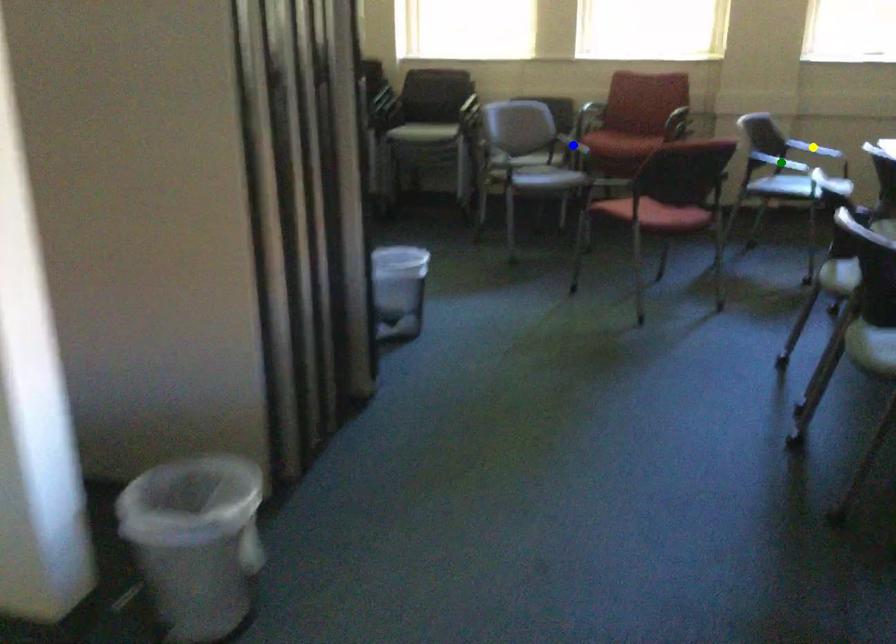
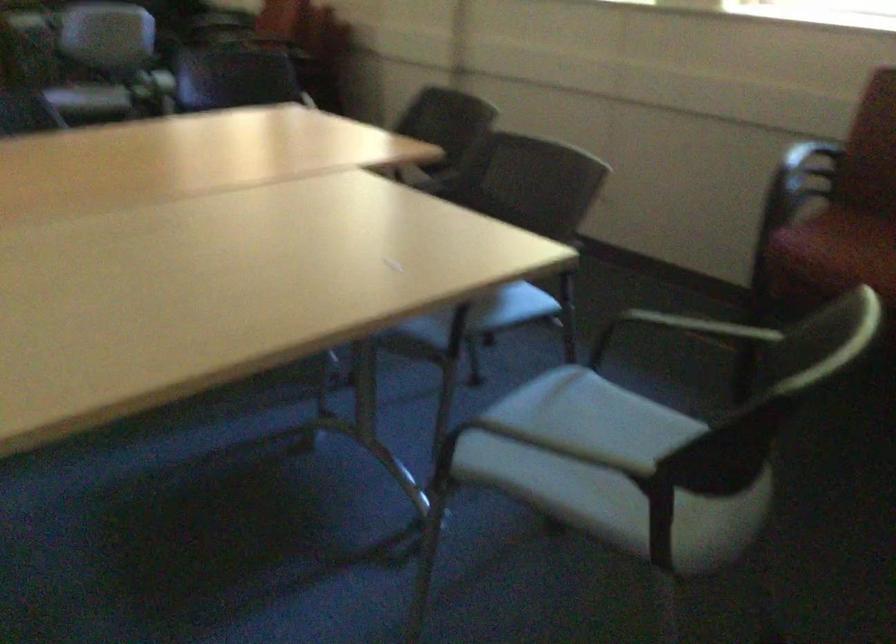
I am providing you with two images of the same scene from different viewpoints. Three points are marked in image1. Which point corresponds to a part or object that is occluded in image2?In image1, three points are marked. Which of them correspond to a part or object that is occluded in image2?Among the three points shown in image1, which one corresponds to a part or object that is no longer visible due to occlusion in image2?

Invisible in image2: blue point, yellow point, green point.